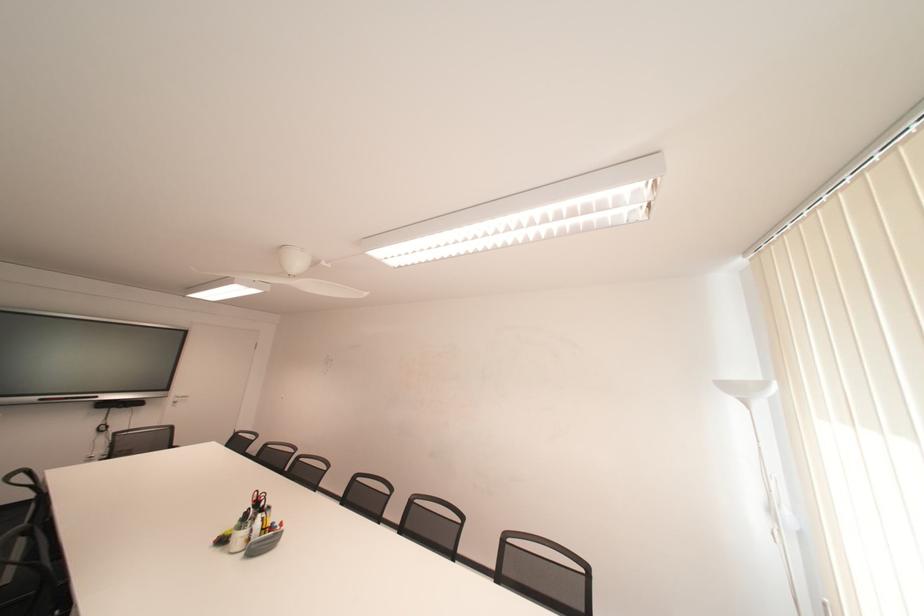
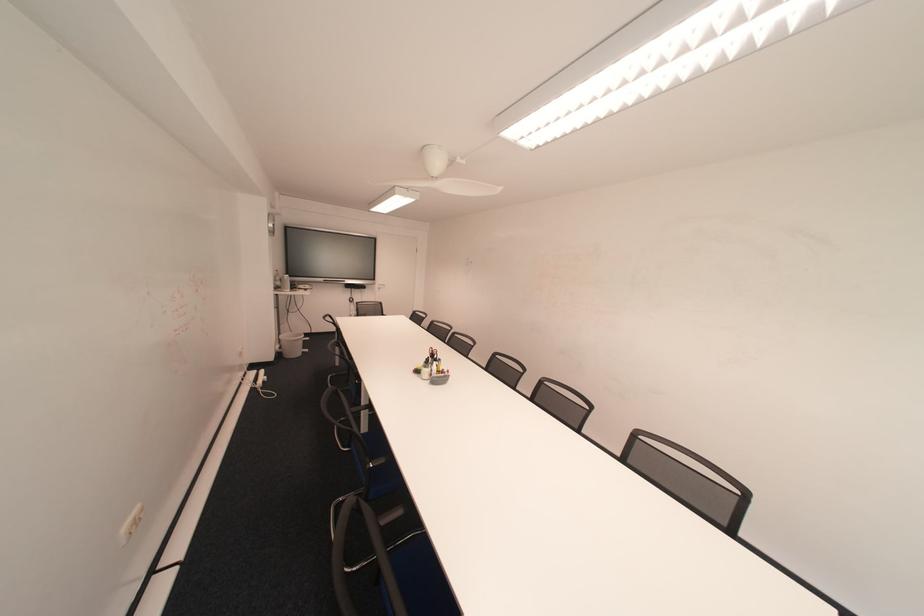
Based on the continuous images, in which direction is the camera rotating?

The rotation direction of the camera is left-down.